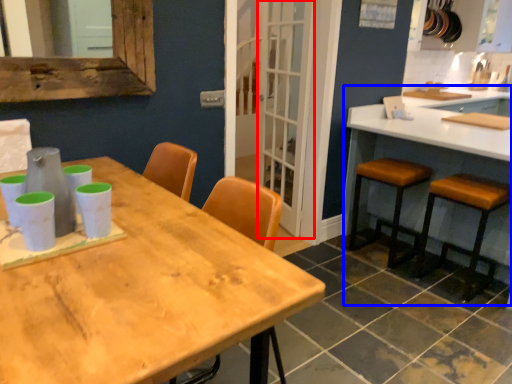
Question: Which object appears farthest to the camera in this image, screen door (highlighted by a red box) or counter (highlighted by a blue box)?

Choices:
 (A) screen door
 (B) counter

Answer: (A)